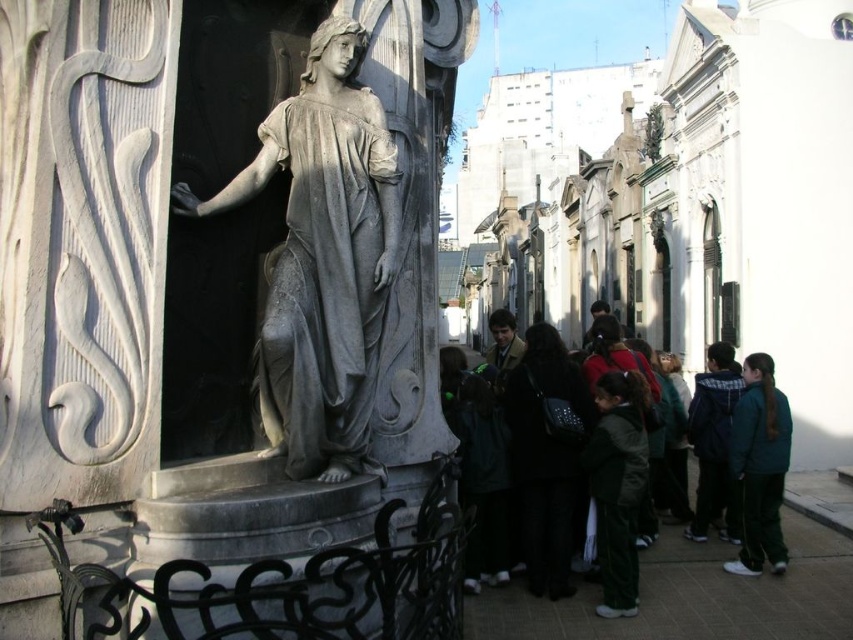
Question: Estimate the real-world distances between objects in this image. Which object is farther from the green fabric jacket at lower right?

Choices:
 (A) gray stone statue at center
 (B) dark blue jacket at center
 (C) green fabric jackets at lower right

Answer: (A)

Question: Which object is positioned farthest from the green fabric jacket at lower right?

Choices:
 (A) green fabric jackets at lower right
 (B) gray stone statue at center
 (C) dark blue jacket at center

Answer: (B)

Question: Is green fabric jackets at lower right wider than green fabric jacket at lower right?

Choices:
 (A) yes
 (B) no

Answer: (A)

Question: Among these points, which one is farthest from the camera?

Choices:
 (A) [x=773, y=522]
 (B) [x=711, y=506]
 (C) [x=306, y=81]
 (D) [x=567, y=461]

Answer: (B)

Question: Can you confirm if gray stone statue at center is bigger than green fabric jacket at lower right?

Choices:
 (A) no
 (B) yes

Answer: (A)

Question: Does gray stone statue at center appear on the left side of green fabric jacket at lower right?

Choices:
 (A) yes
 (B) no

Answer: (A)